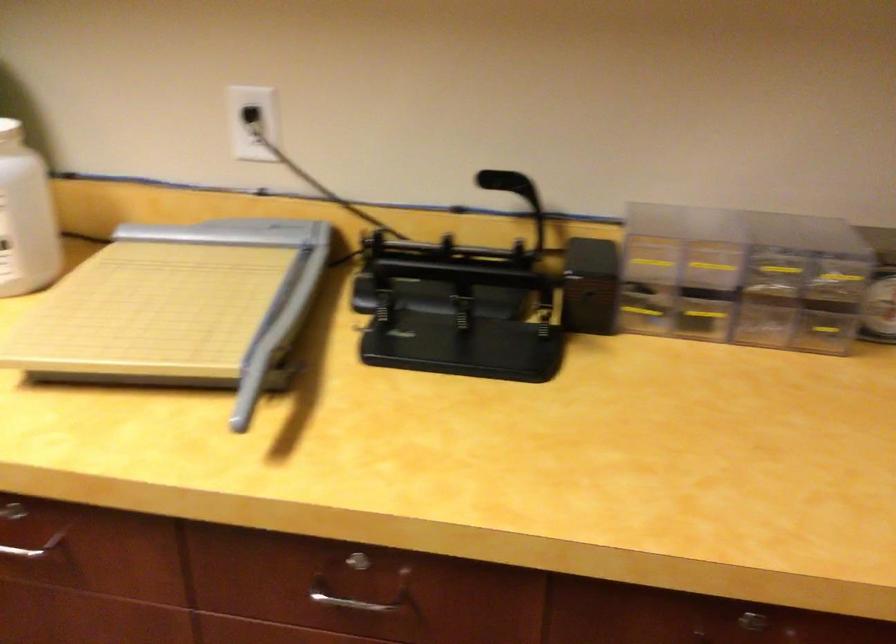
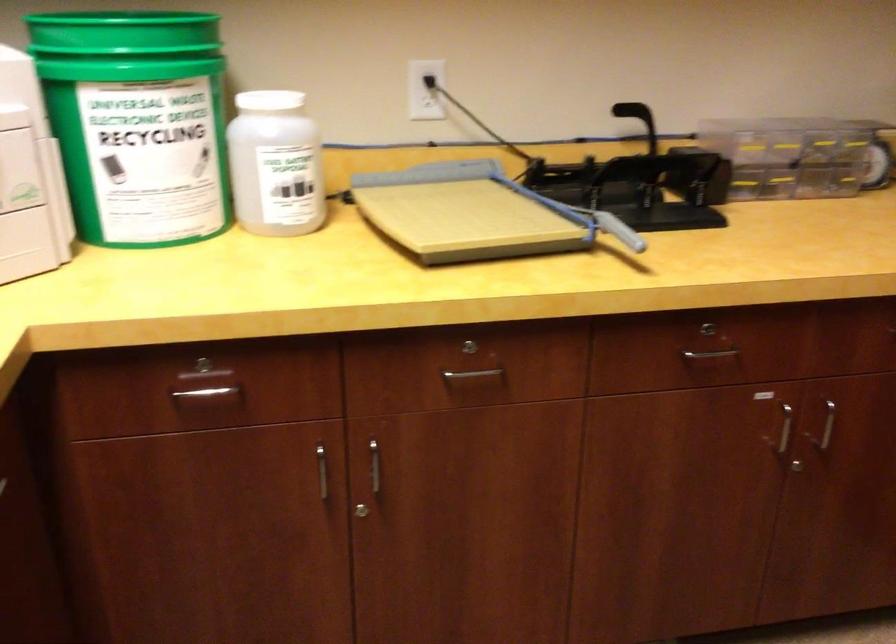
Question: In a continuous first-person perspective shot, in which direction is the camera moving?

Choices:
 (A) Left
 (B) Right
 (C) Forward
 (D) Backward

Answer: (A)